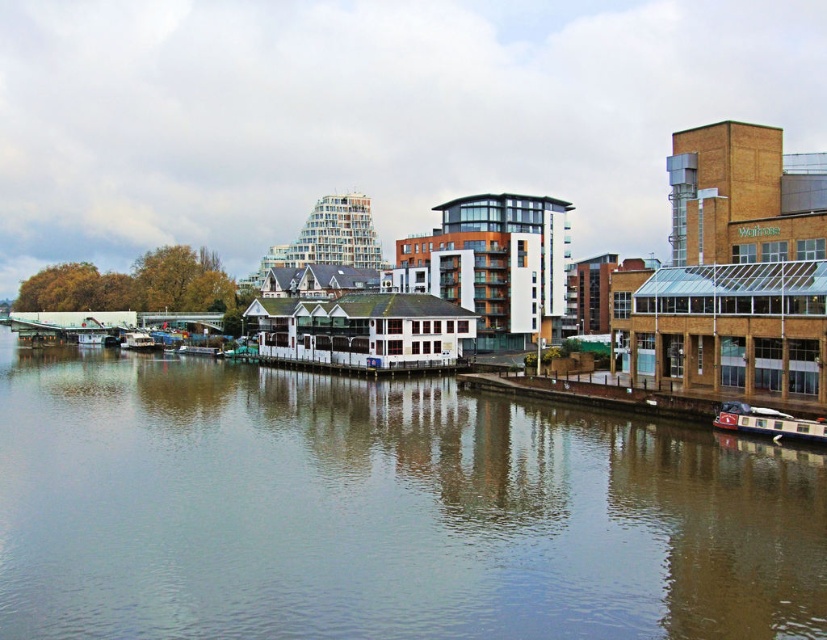
You are standing at the point closer to the riverbank in the image. Which point are you at, point [808,422] or point [122,339]?

You are at point [122,339] because it is closer to the riverbank, which is in the foreground of the image.

You are a delivery drone that needs to fly from the brown water at center to the metallic silver boat at left. Given that your maximum flight distance is 100 meters, can you complete the journey without needing to recharge?

The brown water at center and metallic silver boat at left are 86.92 meters apart from each other. Since the distance is within the drone s 100 meter maximum flight range, the drone can complete the journey without needing to recharge.